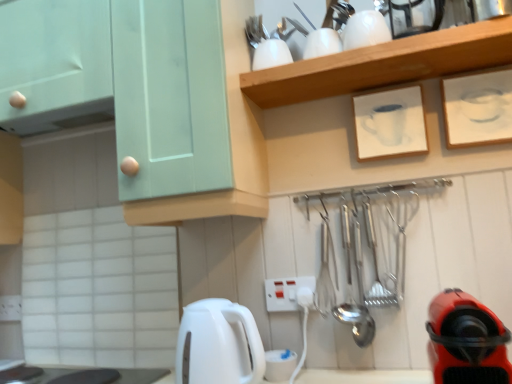
Question: Should I look upward or downward to see white paper at upper right, which is counted as the second picture frame, starting from the left?

Choices:
 (A) up
 (B) down

Answer: (A)

Question: Is white plastic electric outlet at center next to white paper at upper right, which is counted as the second picture frame, starting from the left, and touching it?

Choices:
 (A) yes
 (B) no

Answer: (B)

Question: Is the depth of white plastic electric outlet at center less than that of white paper at upper right, the 1th picture frame positioned from the right?

Choices:
 (A) no
 (B) yes

Answer: (A)

Question: Can you confirm if white plastic electric outlet at center is wider than white paper at upper right, which is counted as the second picture frame, starting from the left?

Choices:
 (A) yes
 (B) no

Answer: (B)

Question: Is white plastic electric outlet at center not close to white paper at upper right, which is counted as the second picture frame, starting from the left?

Choices:
 (A) yes
 (B) no

Answer: (B)

Question: From the image's perspective, is white plastic electric outlet at center over white paper at upper right, which is counted as the second picture frame, starting from the left?

Choices:
 (A) yes
 (B) no

Answer: (B)

Question: Can you confirm if white plastic electric outlet at center is positioned to the left of white paper at upper right, which is counted as the second picture frame, starting from the left?

Choices:
 (A) yes
 (B) no

Answer: (A)

Question: Is white glossy cups at upper center positioned behind white glossy electric kettle at lower center?

Choices:
 (A) no
 (B) yes

Answer: (B)

Question: Is white glossy cups at upper center to the right of white glossy electric kettle at lower center from the viewer's perspective?

Choices:
 (A) no
 (B) yes

Answer: (B)

Question: Is white glossy cups at upper center with white glossy electric kettle at lower center?

Choices:
 (A) yes
 (B) no

Answer: (B)

Question: Is white glossy cups at upper center oriented towards white glossy electric kettle at lower center?

Choices:
 (A) no
 (B) yes

Answer: (A)

Question: Does white glossy cups at upper center have a greater height compared to white glossy electric kettle at lower center?

Choices:
 (A) no
 (B) yes

Answer: (A)

Question: From the image's perspective, is white glossy cups at upper center under white glossy electric kettle at lower center?

Choices:
 (A) no
 (B) yes

Answer: (A)

Question: Is red rubber vacuum cleaner at lower right to the left of white paper at upper right, the 1th picture frame positioned from the right, from the viewer's perspective?

Choices:
 (A) no
 (B) yes

Answer: (B)